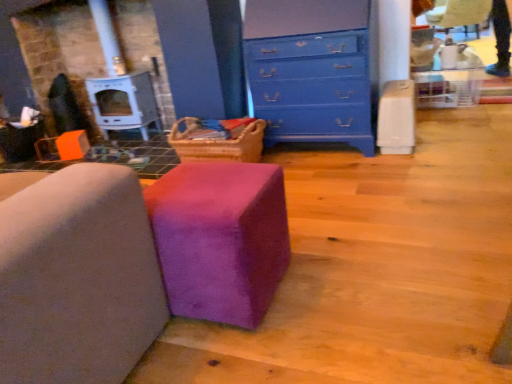
This screenshot has height=384, width=512. Identify the location of blue painted wood chest of drawers at upper center. (313, 69).

The image size is (512, 384). In order to click on purple suede ottoman at center, placed as the 1th furniture when sorted from left to right in this screenshot , I will do pos(78,278).

Does purple fuzzy ottoman at center, marked as the second furniture in a left-to-right arrangement, turn towards purple suede ottoman at center, which is the 2th furniture from right to left?

Yes.

Between purple fuzzy ottoman at center, marked as the second furniture in a left-to-right arrangement, and purple suede ottoman at center, which is the 2th furniture from right to left, which one has larger size?

With larger size is purple suede ottoman at center, which is the 2th furniture from right to left.

Considering their positions, is purple fuzzy ottoman at center, placed as the first furniture when sorted from right to left, located in front of or behind purple suede ottoman at center, placed as the 1th furniture when sorted from left to right?

Visually, purple fuzzy ottoman at center, placed as the first furniture when sorted from right to left, is located behind purple suede ottoman at center, placed as the 1th furniture when sorted from left to right.

Which of these two, purple fuzzy ottoman at center, placed as the first furniture when sorted from right to left, or purple suede ottoman at center, placed as the 1th furniture when sorted from left to right, stands taller?

Standing taller between the two is purple suede ottoman at center, placed as the 1th furniture when sorted from left to right.

Who is smaller, purple fuzzy ottoman at center, marked as the second furniture in a left-to-right arrangement, or blue painted wood chest of drawers at upper center?

With smaller size is purple fuzzy ottoman at center, marked as the second furniture in a left-to-right arrangement.

Is purple fuzzy ottoman at center, marked as the second furniture in a left-to-right arrangement, next to blue painted wood chest of drawers at upper center?

purple fuzzy ottoman at center, marked as the second furniture in a left-to-right arrangement, and blue painted wood chest of drawers at upper center are clearly separated.

Is point (208, 235) farther from camera compared to point (317, 62)?

No, (208, 235) is closer to viewer.

How distant is blue painted wood chest of drawers at upper center from purple fuzzy ottoman at center, marked as the second furniture in a left-to-right arrangement?

A distance of 4.40 feet exists between blue painted wood chest of drawers at upper center and purple fuzzy ottoman at center, marked as the second furniture in a left-to-right arrangement.

Is purple fuzzy ottoman at center, placed as the first furniture when sorted from right to left, at the back of blue painted wood chest of drawers at upper center?

No.

Considering the positions of objects blue painted wood chest of drawers at upper center and purple fuzzy ottoman at center, placed as the first furniture when sorted from right to left, in the image provided, who is behind, blue painted wood chest of drawers at upper center or purple fuzzy ottoman at center, placed as the first furniture when sorted from right to left,?

Positioned behind is blue painted wood chest of drawers at upper center.

Identify the location of the 2nd furniture below the blue painted wood chest of drawers at upper center (from the image's perspective). This screenshot has height=384, width=512. (220, 239).

Which point is more forward, (x=302, y=90) or (x=75, y=375)?

The point (x=75, y=375) is closer to the camera.

Could you measure the distance between blue painted wood chest of drawers at upper center and purple suede ottoman at center, placed as the 1th furniture when sorted from left to right?

5.57 feet.

Identify the location of the 2nd furniture in front when counting from the blue painted wood chest of drawers at upper center. This screenshot has width=512, height=384. (78, 278).

Looking at their sizes, would you say purple suede ottoman at center, placed as the 1th furniture when sorted from left to right, is wider or thinner than blue painted wood chest of drawers at upper center?

Considering their sizes, purple suede ottoman at center, placed as the 1th furniture when sorted from left to right, looks broader than blue painted wood chest of drawers at upper center.

Is point (48, 323) positioned after point (339, 100)?

No, (48, 323) is closer to viewer.

Is purple suede ottoman at center, placed as the 1th furniture when sorted from left to right, facing towards blue painted wood chest of drawers at upper center?

Yes, purple suede ottoman at center, placed as the 1th furniture when sorted from left to right, is oriented towards blue painted wood chest of drawers at upper center.

Is purple suede ottoman at center, which is the 2th furniture from right to left, further to the viewer compared to blue painted wood chest of drawers at upper center?

No.

Which object is wider, purple suede ottoman at center, placed as the 1th furniture when sorted from left to right, or purple fuzzy ottoman at center, placed as the first furniture when sorted from right to left?

purple suede ottoman at center, placed as the 1th furniture when sorted from left to right, is wider.

From a real-world perspective, between purple suede ottoman at center, which is the 2th furniture from right to left, and purple fuzzy ottoman at center, placed as the first furniture when sorted from right to left, who is vertically higher?

In real-world perspective, purple suede ottoman at center, which is the 2th furniture from right to left, is above.

Is purple suede ottoman at center, which is the 2th furniture from right to left, positioned far away from purple fuzzy ottoman at center, marked as the second furniture in a left-to-right arrangement?

No, purple suede ottoman at center, which is the 2th furniture from right to left, is not far from purple fuzzy ottoman at center, marked as the second furniture in a left-to-right arrangement.

Which of these two, purple suede ottoman at center, which is the 2th furniture from right to left, or purple fuzzy ottoman at center, marked as the second furniture in a left-to-right arrangement, stands shorter?

Standing shorter between the two is purple fuzzy ottoman at center, marked as the second furniture in a left-to-right arrangement.

Where is `furniture on the right of purple suede ottoman at center, which is the 2th furniture from right to left`? The height and width of the screenshot is (384, 512). furniture on the right of purple suede ottoman at center, which is the 2th furniture from right to left is located at coordinates (220, 239).

The width and height of the screenshot is (512, 384). What are the coordinates of `the 1st furniture counting from the left side of the blue painted wood chest of drawers at upper center` in the screenshot? It's located at (220, 239).

Estimate the real-world distances between objects in this image. Which object is further from blue painted wood chest of drawers at upper center, purple suede ottoman at center, placed as the 1th furniture when sorted from left to right, or purple fuzzy ottoman at center, marked as the second furniture in a left-to-right arrangement?

purple suede ottoman at center, placed as the 1th furniture when sorted from left to right, is further to blue painted wood chest of drawers at upper center.

Estimate the real-world distances between objects in this image. Which object is further from purple fuzzy ottoman at center, placed as the first furniture when sorted from right to left, purple suede ottoman at center, placed as the 1th furniture when sorted from left to right, or blue painted wood chest of drawers at upper center?

Among the two, blue painted wood chest of drawers at upper center is located further to purple fuzzy ottoman at center, placed as the first furniture when sorted from right to left.

Which object lies nearer to the anchor point blue painted wood chest of drawers at upper center, purple fuzzy ottoman at center, placed as the first furniture when sorted from right to left, or purple suede ottoman at center, placed as the 1th furniture when sorted from left to right?

purple fuzzy ottoman at center, placed as the first furniture when sorted from right to left, is positioned closer to the anchor blue painted wood chest of drawers at upper center.

Consider the image. Estimate the real-world distances between objects in this image. Which object is closer to purple suede ottoman at center, placed as the 1th furniture when sorted from left to right, purple fuzzy ottoman at center, marked as the second furniture in a left-to-right arrangement, or blue painted wood chest of drawers at upper center?

purple fuzzy ottoman at center, marked as the second furniture in a left-to-right arrangement.

Based on the photo, when comparing their distances from purple fuzzy ottoman at center, placed as the first furniture when sorted from right to left, does blue painted wood chest of drawers at upper center or purple suede ottoman at center, placed as the 1th furniture when sorted from left to right, seem further?

Among the two, blue painted wood chest of drawers at upper center is located further to purple fuzzy ottoman at center, placed as the first furniture when sorted from right to left.

Considering their positions, is blue painted wood chest of drawers at upper center positioned further to purple suede ottoman at center, placed as the 1th furniture when sorted from left to right, than purple fuzzy ottoman at center, placed as the first furniture when sorted from right to left?

Among the two, blue painted wood chest of drawers at upper center is located further to purple suede ottoman at center, placed as the 1th furniture when sorted from left to right.

The width and height of the screenshot is (512, 384). Find the location of `furniture between purple suede ottoman at center, placed as the 1th furniture when sorted from left to right, and blue painted wood chest of drawers at upper center, along the z-axis`. furniture between purple suede ottoman at center, placed as the 1th furniture when sorted from left to right, and blue painted wood chest of drawers at upper center, along the z-axis is located at coordinates (220, 239).